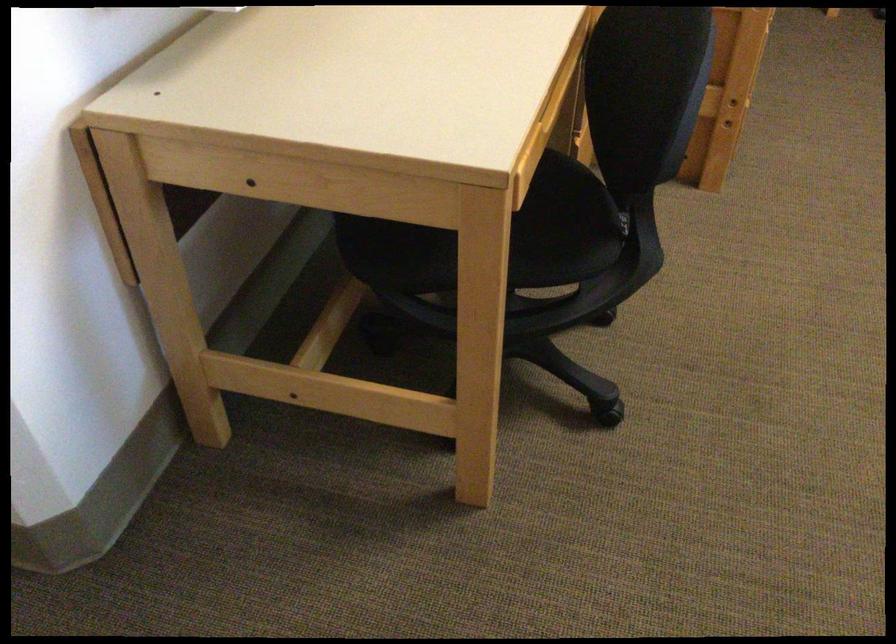
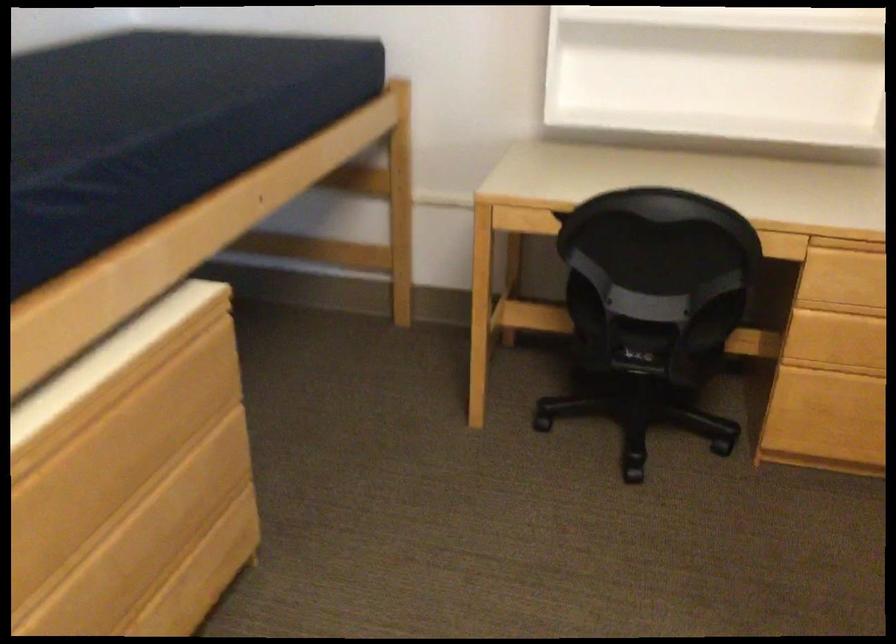
What movement of the cameraman would produce the second image?

The movement direction of the cameraman is right, forward.